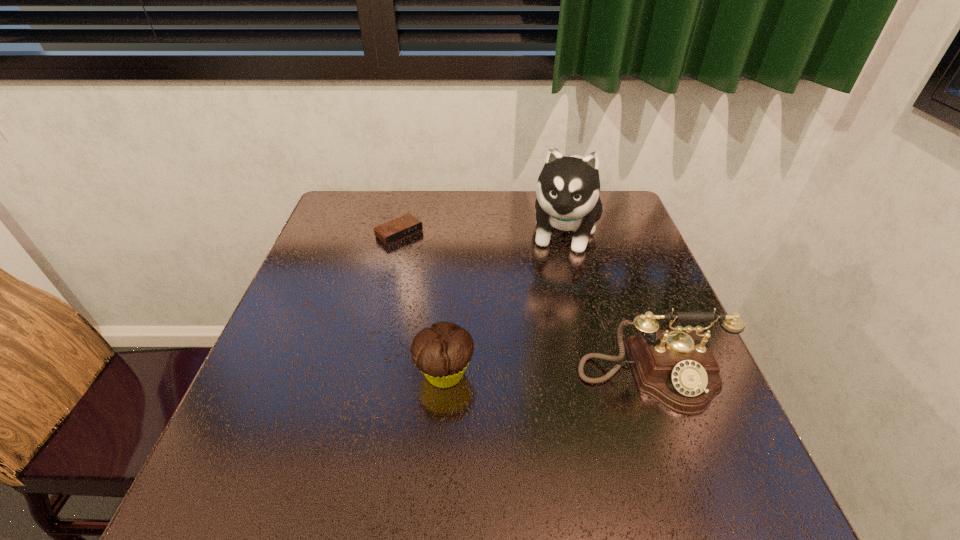
Locate an element on the screen. vacant space located on the front face of the leftmost object is located at coordinates (506, 321).

This screenshot has width=960, height=540. What are the coordinates of `free space located at the face of the tallest object` in the screenshot? It's located at (552, 308).

You are a GUI agent. You are given a task and a screenshot of the screen. Output one action in this format:
    pyautogui.click(x=<x>, y=<y>)
    Task: Click on the free space located 0.270m at the face of the tallest object
    
    Given the screenshot: What is the action you would take?
    pyautogui.click(x=543, y=347)

Where is `vacant space located at the face of the tallest object`? vacant space located at the face of the tallest object is located at coordinates (555, 297).

In order to click on alarm clock that is positioned at the far edge in this screenshot , I will do `click(402, 227)`.

Identify the location of puppy that is at the far edge. The width and height of the screenshot is (960, 540). (568, 188).

The image size is (960, 540). In order to click on object positioned at the near edge in this screenshot , I will do tap(676, 367).

Identify the location of object positioned at the left edge. (402, 227).

Where is `telephone located at the right edge`? This screenshot has width=960, height=540. telephone located at the right edge is located at coordinates (676, 367).

I want to click on puppy that is at the right edge, so click(x=568, y=188).